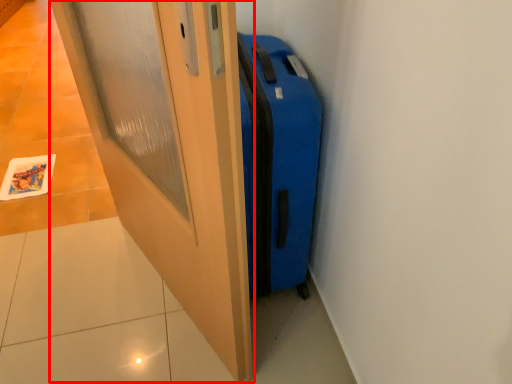
Question: From the image, what is the correct spatial relationship of door (annotated by the red box) in relation to suitcase?

Choices:
 (A) left
 (B) right

Answer: (A)